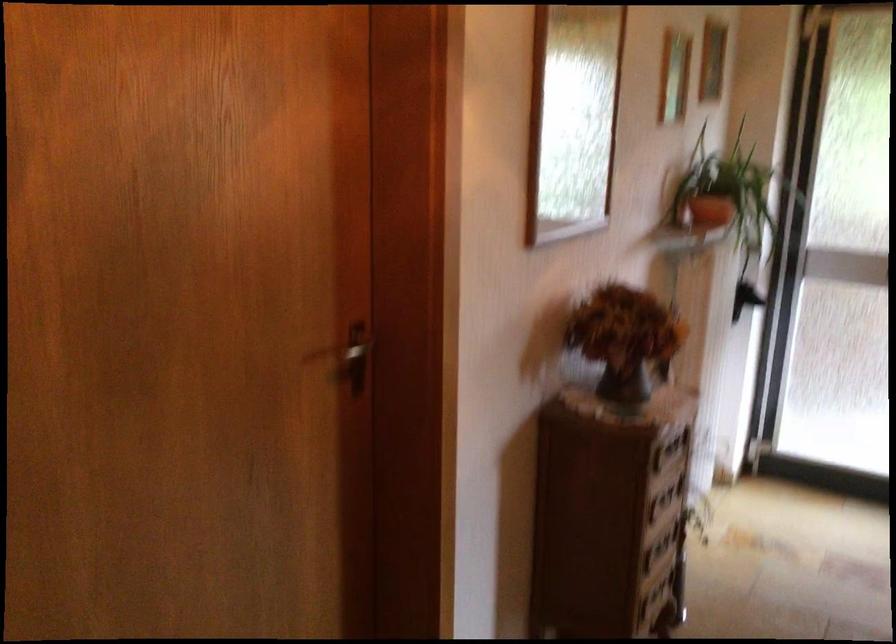
Find the location of `dark flower vase`. dark flower vase is located at coordinates click(x=624, y=339).